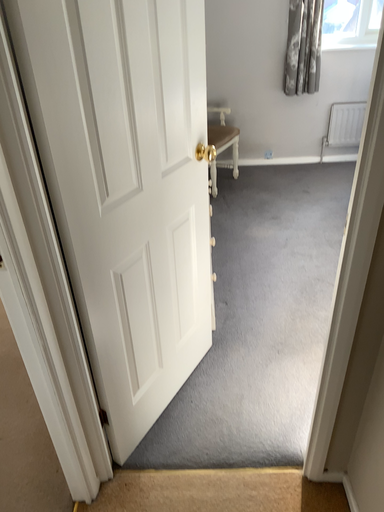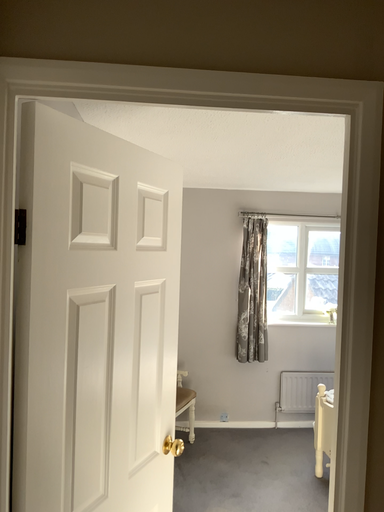
Question: How did the camera likely rotate when shooting the video?

Choices:
 (A) rotated left
 (B) rotated right

Answer: (B)